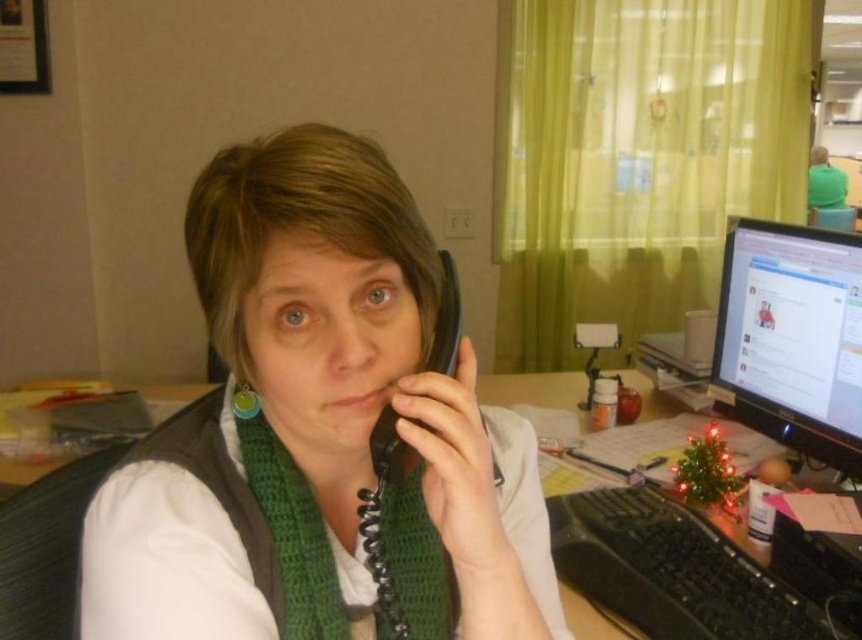
You are a delivery person who needs to place a small package on the desk without disturbing the white matte vest at center or the black plastic keyboard at center. The package requires 12 inches of space. Can you fit it between them?

The white matte vest at center is 30.14 inches from the black plastic keyboard at center. Since the package requires 12 inches of space, there is sufficient room to place it between them without disturbing either object.

What object is located at the coordinates point [360,394] in the image?

The point [360,394] indicates the white matte vest at center.